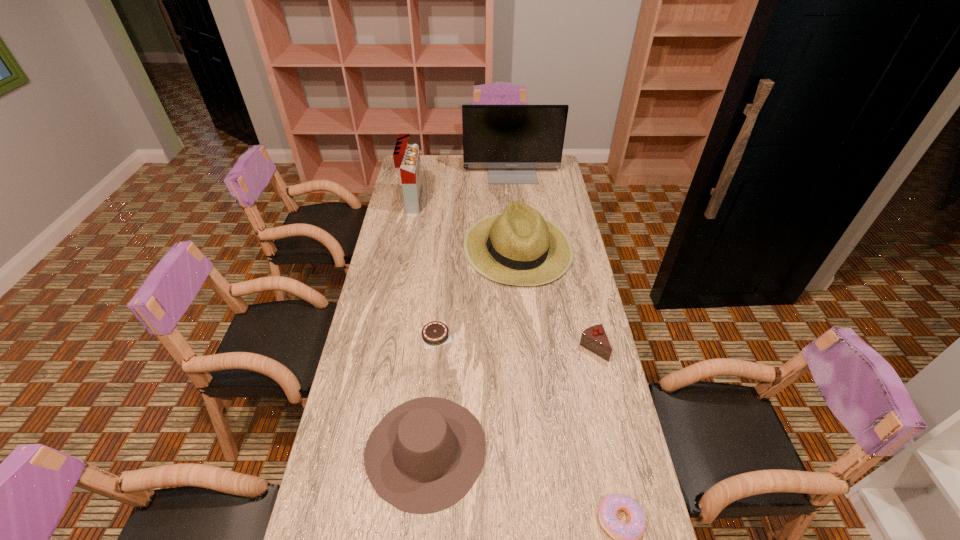
Image resolution: width=960 pixels, height=540 pixels. I want to click on object that is at the far right corner, so click(511, 141).

At what (x,y) coordinates should I click in order to perform the action: click on vacant area at the left edge. Please return your answer as a coordinate pair (x, y). The height and width of the screenshot is (540, 960). Looking at the image, I should click on pos(395,318).

This screenshot has width=960, height=540. What are the coordinates of `vacant space at the right edge of the desktop` in the screenshot? It's located at (541, 202).

At what (x,y) coordinates should I click in order to perform the action: click on vacant region at the far left corner of the desktop. Please return your answer as a coordinate pair (x, y). Looking at the image, I should click on 427,158.

In the image, there is a desktop. Identify the location of free space at the far right corner. (554, 171).

Image resolution: width=960 pixels, height=540 pixels. I want to click on free space between the fourth tallest object and the fifth shortest object, so click(x=471, y=348).

Find the location of a particular element. free space between the fourth shortest object and the third tallest object is located at coordinates (471, 348).

The height and width of the screenshot is (540, 960). Identify the location of unoccupied position between the cowboy hat and the cigarette case. (420, 326).

This screenshot has height=540, width=960. Identify the location of object identified as the closest to the left chocolate cake. (520, 247).

Identify which object is the closest to the sunhat. Please provide its 2D coordinates. Your answer should be formatted as a tuple, i.e. [(x, y)], where the tuple contains the x and y coordinates of a point satisfying the conditions above.

[(435, 333)]